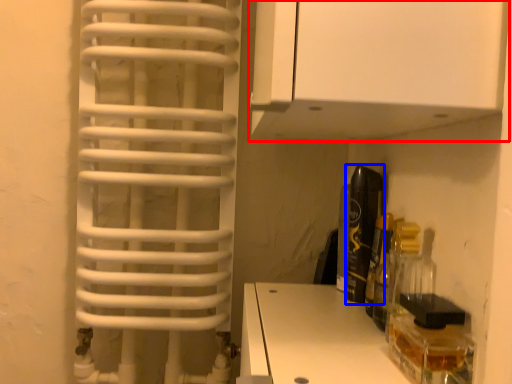
Question: Which object is closer to the camera taking this photo, cabinetry (highlighted by a red box) or bottle (highlighted by a blue box)?

Choices:
 (A) cabinetry
 (B) bottle

Answer: (A)